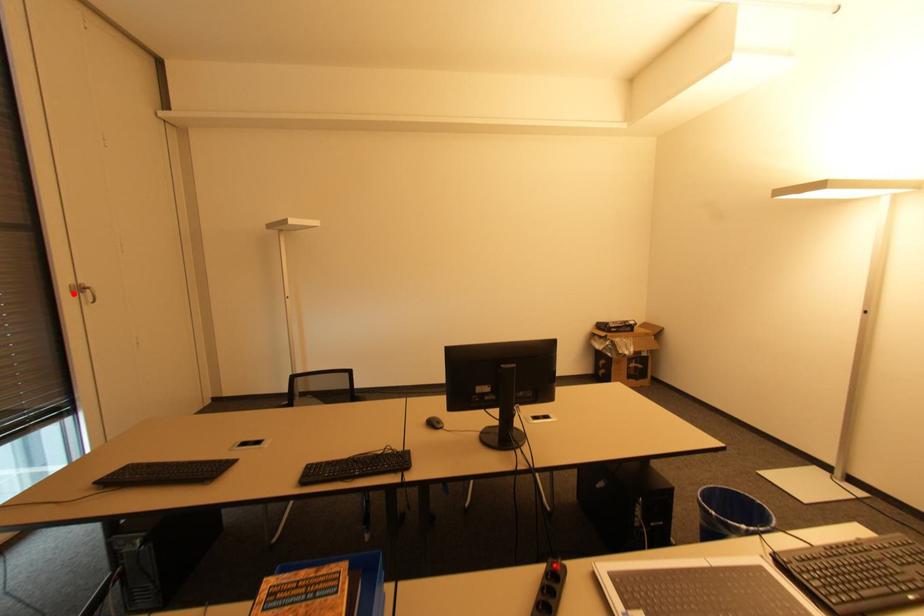
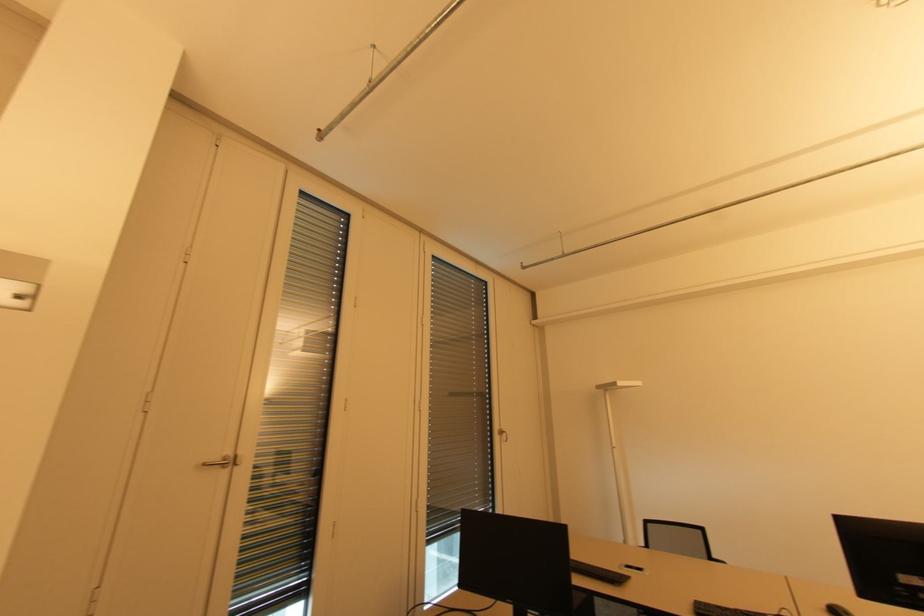
Find the pixel in the second image that matches the highlighted location in the first image.

(501, 435)